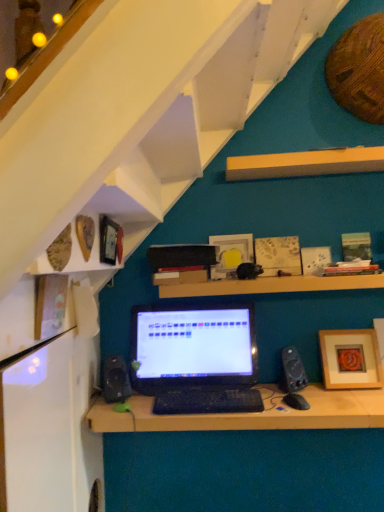
Find the location of a particular element. vacant space to the right of black matte computer mouse at lower right is located at coordinates (335, 406).